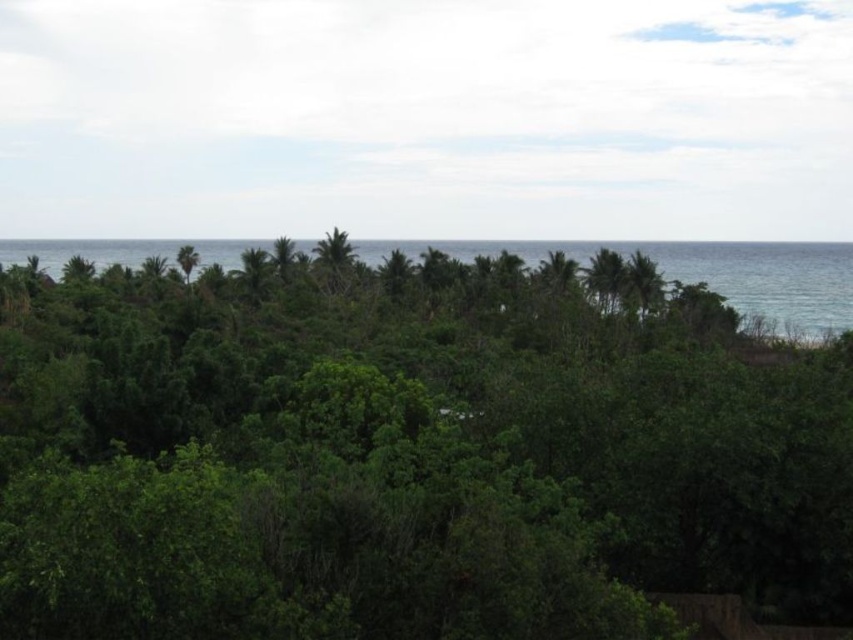
Question: Which of the following is the farthest from the observer?

Choices:
 (A) green leafy tree at upper right
 (B) blue water at upper center

Answer: (B)

Question: Can you confirm if green leafy tree at center is positioned to the right of blue water at upper center?

Choices:
 (A) yes
 (B) no

Answer: (B)

Question: Is green leafy tree at center to the left of green leafy tree at upper right from the viewer's perspective?

Choices:
 (A) yes
 (B) no

Answer: (A)

Question: Which of these objects is positioned closest to the blue water at upper center?

Choices:
 (A) green leafy tree at center
 (B) green leafy tree at left

Answer: (A)

Question: Which of the following is the closest to the observer?

Choices:
 (A) green leafy tree at center
 (B) blue water at upper center
 (C) green leafy tree at left

Answer: (A)

Question: Does green leafy tree at center have a larger size compared to blue water at upper center?

Choices:
 (A) yes
 (B) no

Answer: (B)